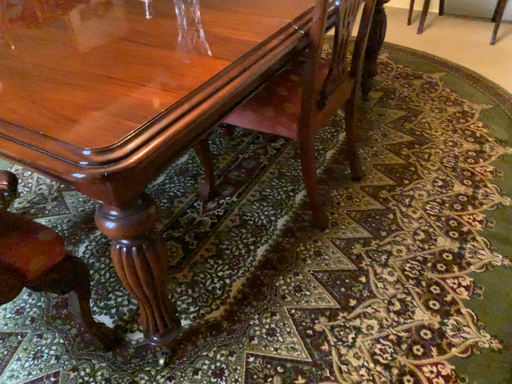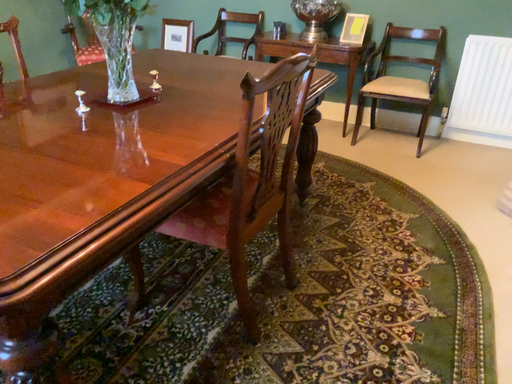
Question: Which way did the camera rotate in the video?

Choices:
 (A) rotated right
 (B) rotated left

Answer: (A)